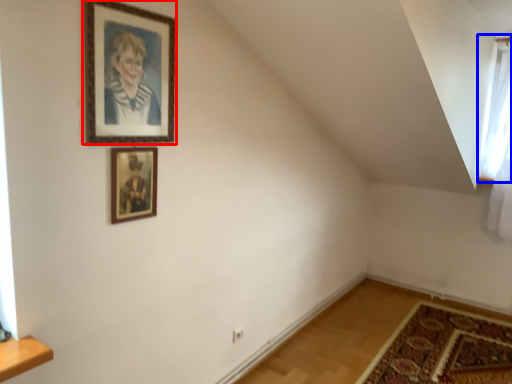
Question: Which point is further to the camera, picture frame (highlighted by a red box) or window (highlighted by a blue box)?

Choices:
 (A) picture frame
 (B) window

Answer: (B)